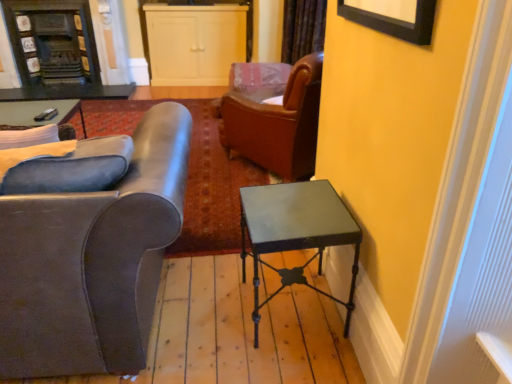
Question: Does matte black remote control at upper left have a larger size compared to matte gray leather armchair at left?

Choices:
 (A) yes
 (B) no

Answer: (B)

Question: Is matte black remote control at upper left aimed at matte gray leather armchair at left?

Choices:
 (A) no
 (B) yes

Answer: (A)

Question: Is matte black remote control at upper left taller than matte gray leather armchair at left?

Choices:
 (A) yes
 (B) no

Answer: (B)

Question: Is matte black remote control at upper left far away from matte gray leather armchair at left?

Choices:
 (A) no
 (B) yes

Answer: (B)

Question: Is the position of matte black remote control at upper left less distant than that of matte gray leather armchair at left?

Choices:
 (A) yes
 (B) no

Answer: (B)

Question: Based on their positions, is velvet brown curtain at upper center located to the left or right of metallic green table at right?

Choices:
 (A) right
 (B) left

Answer: (A)

Question: From a real-world perspective, is velvet brown curtain at upper center positioned above or below metallic green table at right?

Choices:
 (A) above
 (B) below

Answer: (A)

Question: Considering the positions of velvet brown curtain at upper center and metallic green table at right in the image, is velvet brown curtain at upper center wider or thinner than metallic green table at right?

Choices:
 (A) thin
 (B) wide

Answer: (A)

Question: In the image, is velvet brown curtain at upper center positioned in front of or behind metallic green table at right?

Choices:
 (A) front
 (B) behind

Answer: (B)

Question: Looking at their shapes, would you say metallic green table at right is wider or thinner than dark wood fireplace at upper left, which is counted as the first cabinetry, starting from the left?

Choices:
 (A) thin
 (B) wide

Answer: (B)

Question: From the image's perspective, is metallic green table at right positioned above or below dark wood fireplace at upper left, which is counted as the first cabinetry, starting from the left?

Choices:
 (A) below
 (B) above

Answer: (A)

Question: Does point (250, 231) appear closer or farther from the camera than point (94, 76)?

Choices:
 (A) closer
 (B) farther

Answer: (A)

Question: Considering the relative positions of metallic green table at right and dark wood fireplace at upper left, placed as the second cabinetry when sorted from right to left, in the image provided, is metallic green table at right to the left or to the right of dark wood fireplace at upper left, placed as the second cabinetry when sorted from right to left,?

Choices:
 (A) left
 (B) right

Answer: (B)

Question: Based on their sizes in the image, would you say white matte cabinet at upper center, the second cabinetry when ordered from left to right, is bigger or smaller than metallic green table at right?

Choices:
 (A) big
 (B) small

Answer: (A)

Question: Considering the positions of point (167, 77) and point (330, 185), is point (167, 77) closer or farther from the camera than point (330, 185)?

Choices:
 (A) farther
 (B) closer

Answer: (A)